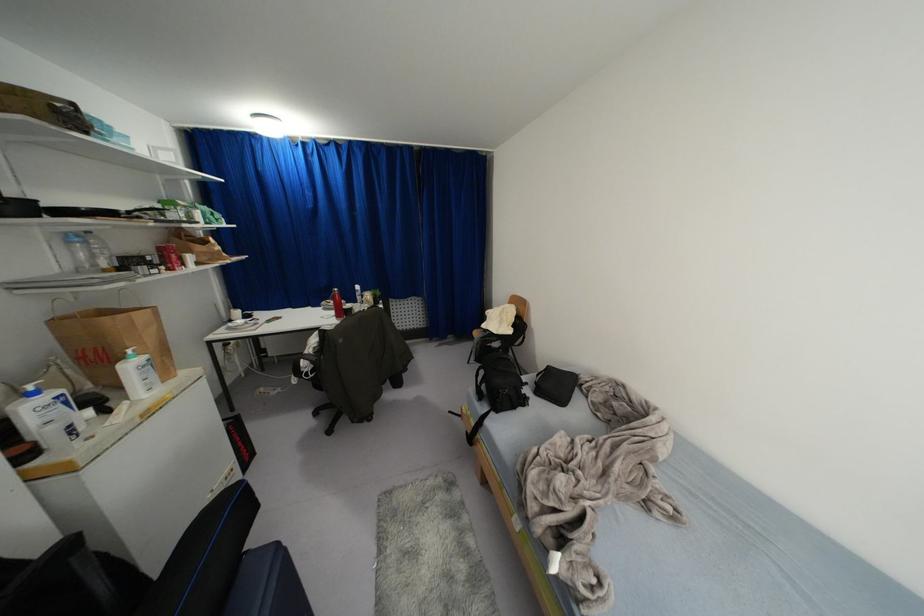
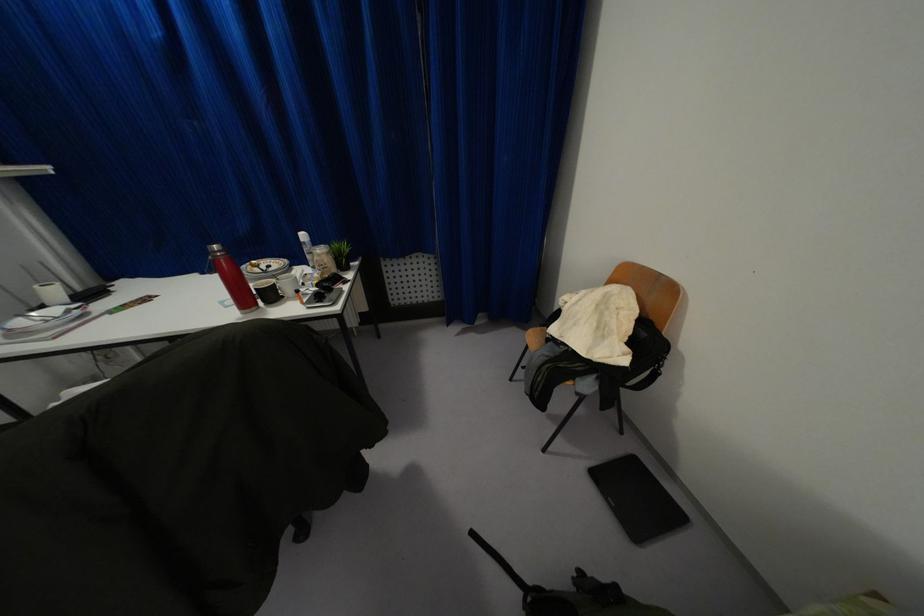
Question: The images are taken continuously from a first-person perspective. In which direction are you moving?

Choices:
 (A) Left
 (B) Right
 (C) Forward
 (D) Backward

Answer: (C)